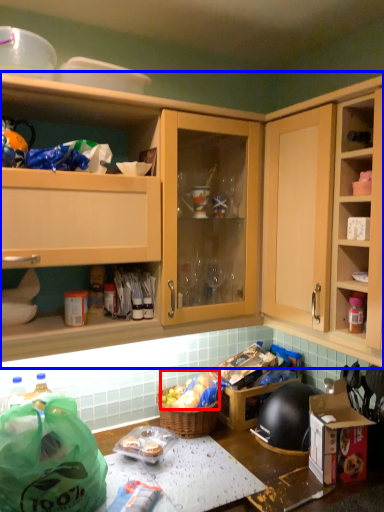
Question: Which point is closer to the camera, stuff (highlighted by a red box) or cabinetry (highlighted by a blue box)?

Choices:
 (A) stuff
 (B) cabinetry

Answer: (B)